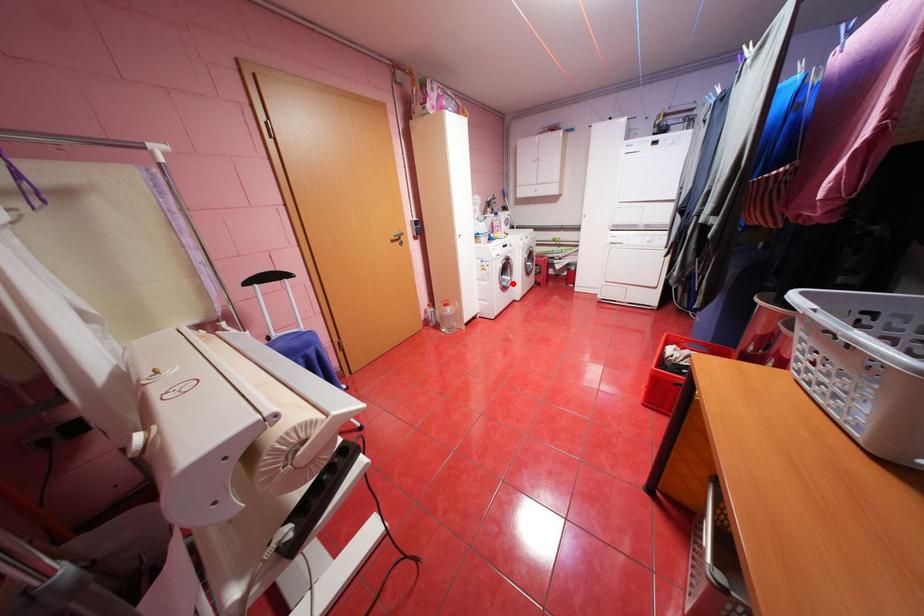
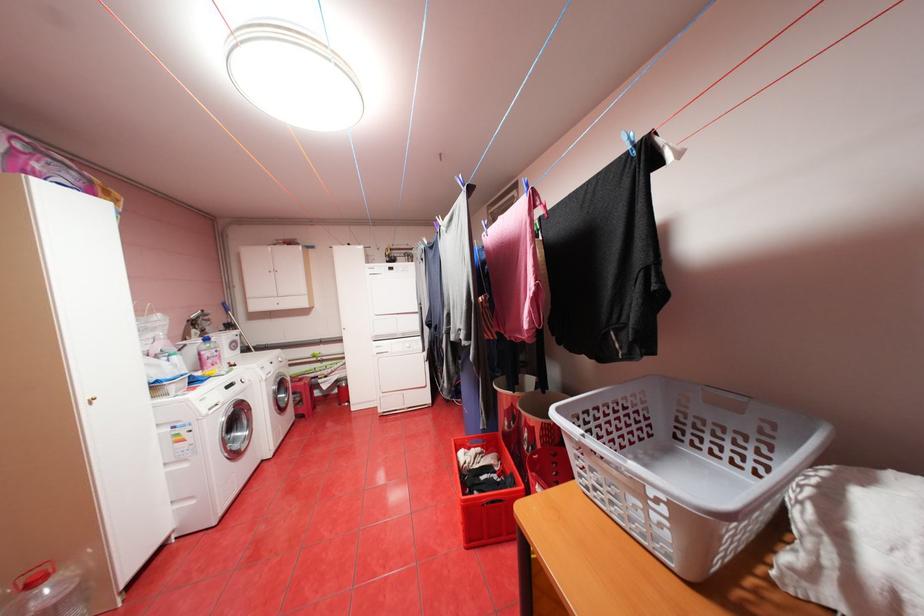
Where in the second image is the point corresponding to the highlighted location from the first image?

(245, 446)